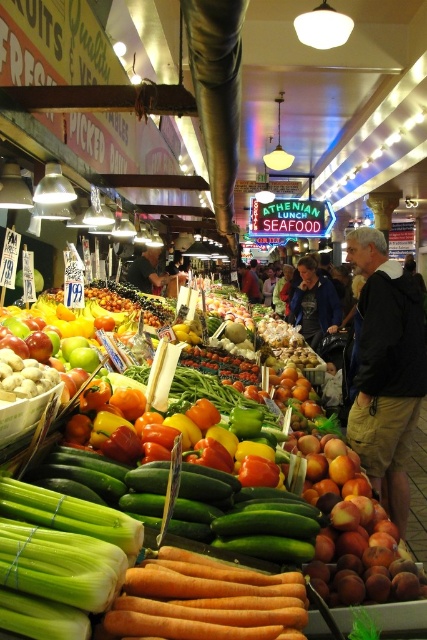
You are a customer in the market and want to pick up the orange smooth carrot at lower center. There is a black cotton jacket at center in your way. Which object should you move first to reach the carrot?

You should move the black cotton jacket at center first because it is closer to you and blocking the path to the orange smooth carrot at lower center.

Looking at this image, you are a customer at the market and want to place the black cotton jacket at center on top of the orange smooth carrot at lower center. Will the jacket fit entirely on the carrot without overlapping the edges?

The black cotton jacket at center is wider than the orange smooth carrot at lower center, so placing the jacket on top would cause it to overlap the edges of the carrot.

You are standing at the point marked as point (290, 598) in the image. You want to pick up a tomato from the midground display. Considering your height is 1.7 meters, can you comfortably reach the tomato without needing a stool?

The point marked as point (290, 598) is 1.40 meters away from the viewer. Since the viewer is 1.7 meters tall, they can comfortably reach the tomato in the midground display without needing a stool as the distance is within a manageable range.